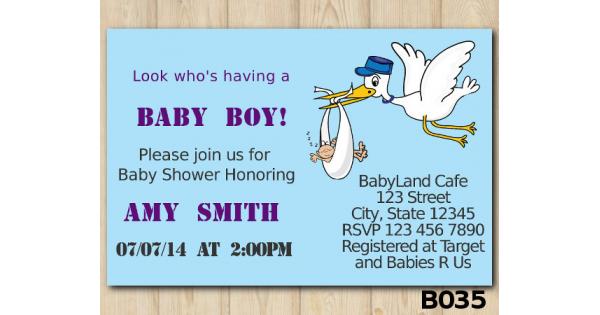
I want to click on blue poster, so click(313, 210).